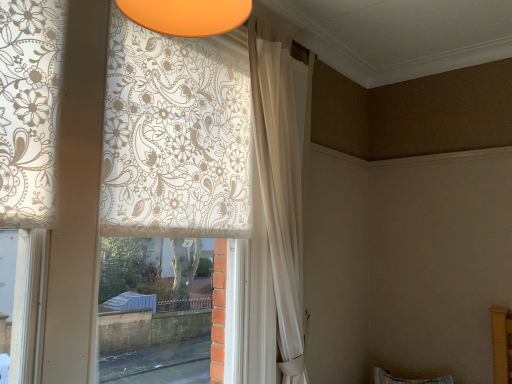
In order to click on white sheer curtain at upper center, which appears as the second curtain when viewed from the left in this screenshot , I will do `click(280, 188)`.

This screenshot has width=512, height=384. Describe the element at coordinates (280, 188) in the screenshot. I see `white sheer curtain at upper center, the 1th curtain when ordered from right to left` at that location.

Describe the element at coordinates (175, 137) in the screenshot. This screenshot has width=512, height=384. I see `white floral-patterned curtain at upper left, the second curtain viewed from the right` at that location.

This screenshot has width=512, height=384. What are the coordinates of `white floral-patterned curtain at upper left, arranged as the 1th curtain when viewed from the left` in the screenshot? It's located at (175, 137).

Locate an element on the screen. This screenshot has width=512, height=384. white sheer curtain at upper center, the 1th curtain when ordered from right to left is located at coordinates (280, 188).

Considering the positions of objects white sheer curtain at upper center, the 1th curtain when ordered from right to left, and white floral-patterned curtain at upper left, arranged as the 1th curtain when viewed from the left, in the image provided, who is more to the left, white sheer curtain at upper center, the 1th curtain when ordered from right to left, or white floral-patterned curtain at upper left, arranged as the 1th curtain when viewed from the left,?

From the viewer's perspective, white floral-patterned curtain at upper left, arranged as the 1th curtain when viewed from the left, appears more on the left side.

Which is behind, white sheer curtain at upper center, which appears as the second curtain when viewed from the left, or white floral-patterned curtain at upper left, the second curtain viewed from the right?

white sheer curtain at upper center, which appears as the second curtain when viewed from the left, is behind.

Considering the points (293, 337) and (129, 85), which point is in front, point (293, 337) or point (129, 85)?

Positioned in front is point (129, 85).

From the image's perspective, would you say white sheer curtain at upper center, which appears as the second curtain when viewed from the left, is shown under white floral-patterned curtain at upper left, arranged as the 1th curtain when viewed from the left?

Yes.

From a real-world perspective, which object stands above the other?

In real-world perspective, white sheer curtain at upper center, which appears as the second curtain when viewed from the left, is above.

Which object is wider, white sheer curtain at upper center, the 1th curtain when ordered from right to left, or white floral-patterned curtain at upper left, arranged as the 1th curtain when viewed from the left?

white floral-patterned curtain at upper left, arranged as the 1th curtain when viewed from the left, is wider.

Who is taller, white sheer curtain at upper center, the 1th curtain when ordered from right to left, or white floral-patterned curtain at upper left, the second curtain viewed from the right?

With more height is white sheer curtain at upper center, the 1th curtain when ordered from right to left.

Between white sheer curtain at upper center, which appears as the second curtain when viewed from the left, and white floral-patterned curtain at upper left, arranged as the 1th curtain when viewed from the left, which one has smaller size?

white sheer curtain at upper center, which appears as the second curtain when viewed from the left.

Is white sheer curtain at upper center, the 1th curtain when ordered from right to left, inside or outside of white floral-patterned curtain at upper left, the second curtain viewed from the right?

white sheer curtain at upper center, the 1th curtain when ordered from right to left, is not enclosed by white floral-patterned curtain at upper left, the second curtain viewed from the right.

Is white sheer curtain at upper center, the 1th curtain when ordered from right to left, positioned far away from white floral-patterned curtain at upper left, arranged as the 1th curtain when viewed from the left?

No, there isn't a large distance between white sheer curtain at upper center, the 1th curtain when ordered from right to left, and white floral-patterned curtain at upper left, arranged as the 1th curtain when viewed from the left.

Based on the photo, is white sheer curtain at upper center, which appears as the second curtain when viewed from the left, positioned with its back to white floral-patterned curtain at upper left, arranged as the 1th curtain when viewed from the left?

Yes.

How different are the orientations of white sheer curtain at upper center, which appears as the second curtain when viewed from the left, and white floral-patterned curtain at upper left, arranged as the 1th curtain when viewed from the left, in degrees?

1.92e-05 degrees.

Could you measure the distance between white sheer curtain at upper center, the 1th curtain when ordered from right to left, and white floral-patterned curtain at upper left, arranged as the 1th curtain when viewed from the left?

white sheer curtain at upper center, the 1th curtain when ordered from right to left, is 15.82 inches away from white floral-patterned curtain at upper left, arranged as the 1th curtain when viewed from the left.

Locate an element on the screen. This screenshot has height=384, width=512. curtain above the white floral-patterned curtain at upper left, the second curtain viewed from the right (from a real-world perspective) is located at coordinates (280, 188).

Between white floral-patterned curtain at upper left, arranged as the 1th curtain when viewed from the left, and white sheer curtain at upper center, the 1th curtain when ordered from right to left, which one appears on the right side from the viewer's perspective?

From the viewer's perspective, white sheer curtain at upper center, the 1th curtain when ordered from right to left, appears more on the right side.

Considering their positions, is white floral-patterned curtain at upper left, the second curtain viewed from the right, located in front of or behind white sheer curtain at upper center, the 1th curtain when ordered from right to left?

white floral-patterned curtain at upper left, the second curtain viewed from the right, is positioned closer to the viewer than white sheer curtain at upper center, the 1th curtain when ordered from right to left.

Considering the points (5, 45) and (285, 297), which point is in front, point (5, 45) or point (285, 297)?

The point (5, 45) is more forward.

From the image's perspective, is white floral-patterned curtain at upper left, arranged as the 1th curtain when viewed from the left, on top of white sheer curtain at upper center, the 1th curtain when ordered from right to left?

Yes, from the image's perspective, white floral-patterned curtain at upper left, arranged as the 1th curtain when viewed from the left, is over white sheer curtain at upper center, the 1th curtain when ordered from right to left.

From a real-world perspective, is white floral-patterned curtain at upper left, arranged as the 1th curtain when viewed from the left, over white sheer curtain at upper center, the 1th curtain when ordered from right to left?

No, from a real-world perspective, white floral-patterned curtain at upper left, arranged as the 1th curtain when viewed from the left, is not over white sheer curtain at upper center, the 1th curtain when ordered from right to left

Is white floral-patterned curtain at upper left, the second curtain viewed from the right, wider than white sheer curtain at upper center, the 1th curtain when ordered from right to left?

Yes.

Between white floral-patterned curtain at upper left, the second curtain viewed from the right, and white sheer curtain at upper center, the 1th curtain when ordered from right to left, which one has more height?

white sheer curtain at upper center, the 1th curtain when ordered from right to left.

Is white floral-patterned curtain at upper left, the second curtain viewed from the right, bigger than white sheer curtain at upper center, the 1th curtain when ordered from right to left?

Correct, white floral-patterned curtain at upper left, the second curtain viewed from the right, is larger in size than white sheer curtain at upper center, the 1th curtain when ordered from right to left.

Is white sheer curtain at upper center, which appears as the second curtain when viewed from the left, located within white floral-patterned curtain at upper left, the second curtain viewed from the right?

No, white sheer curtain at upper center, which appears as the second curtain when viewed from the left, is not a part of white floral-patterned curtain at upper left, the second curtain viewed from the right.

Are white floral-patterned curtain at upper left, arranged as the 1th curtain when viewed from the left, and white sheer curtain at upper center, the 1th curtain when ordered from right to left, far apart?

Actually, white floral-patterned curtain at upper left, arranged as the 1th curtain when viewed from the left, and white sheer curtain at upper center, the 1th curtain when ordered from right to left, are a little close together.

Is white floral-patterned curtain at upper left, arranged as the 1th curtain when viewed from the left, facing towards white sheer curtain at upper center, the 1th curtain when ordered from right to left?

Yes, white floral-patterned curtain at upper left, arranged as the 1th curtain when viewed from the left, is facing white sheer curtain at upper center, the 1th curtain when ordered from right to left.

Identify the location of curtain below the white floral-patterned curtain at upper left, arranged as the 1th curtain when viewed from the left (from the image's perspective). This screenshot has height=384, width=512. (280, 188).

Locate an element on the screen. Image resolution: width=512 pixels, height=384 pixels. curtain on the right of white floral-patterned curtain at upper left, arranged as the 1th curtain when viewed from the left is located at coordinates click(x=280, y=188).

Find the location of a particular element. This screenshot has height=384, width=512. curtain that appears above the white sheer curtain at upper center, the 1th curtain when ordered from right to left (from the image's perspective) is located at coordinates (175, 137).